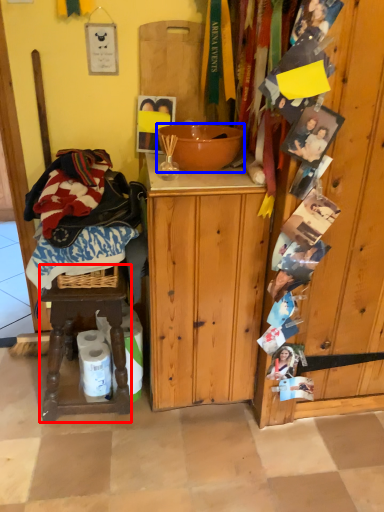
Question: Which of the following is the closest to the observer, stool (highlighted by a red box) or bowl (highlighted by a blue box)?

Choices:
 (A) stool
 (B) bowl

Answer: (B)